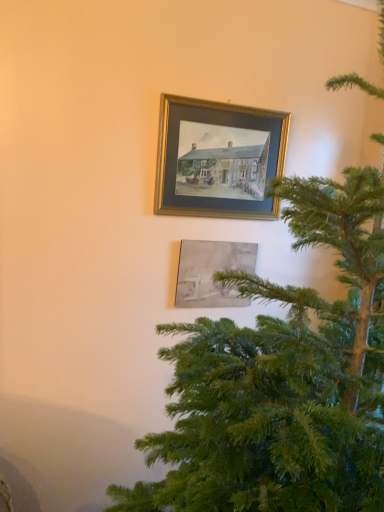
Question: In terms of height, does gold metallic picture frame at upper center, which is the 2th picture frame in bottom-to-top order, look taller or shorter compared to gray matte painting at lower center, arranged as the 1th picture frame when ordered from the bottom?

Choices:
 (A) short
 (B) tall

Answer: (B)

Question: In the image, is gold metallic picture frame at upper center, which is counted as the 1th picture frame, starting from the top, positioned in front of or behind gray matte painting at lower center, arranged as the 1th picture frame when ordered from the bottom?

Choices:
 (A) front
 (B) behind

Answer: (A)

Question: Which object is the farthest from the gold metallic picture frame at upper center, which is counted as the 1th picture frame, starting from the top?

Choices:
 (A) gray matte painting at lower center, arranged as the 1th picture frame when ordered from the bottom
 (B) green textured christmas tree at right

Answer: (B)

Question: Which object is the closest to the green textured christmas tree at right?

Choices:
 (A) gray matte painting at lower center, arranged as the second picture frame when viewed from the top
 (B) gold metallic picture frame at upper center, which is counted as the 1th picture frame, starting from the top

Answer: (A)